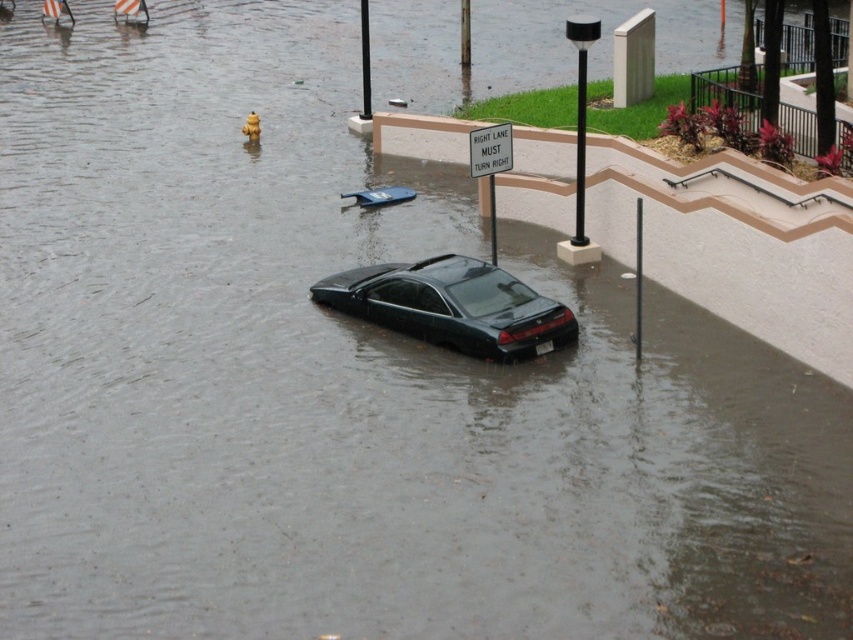
Question: Which point is farther to the camera?

Choices:
 (A) (489, 131)
 (B) (410, 324)

Answer: (A)

Question: Is dark gray matte car at center positioned behind white plastic sign at center?

Choices:
 (A) no
 (B) yes

Answer: (A)

Question: Among these points, which one is farthest from the camera?

Choices:
 (A) (363, 316)
 (B) (500, 147)

Answer: (B)

Question: Can you confirm if dark gray matte car at center is bigger than white plastic sign at center?

Choices:
 (A) no
 (B) yes

Answer: (B)

Question: Is dark gray matte car at center thinner than white plastic sign at center?

Choices:
 (A) yes
 (B) no

Answer: (B)

Question: Which of the following is the closest to the observer?

Choices:
 (A) dark gray matte car at center
 (B) white plastic sign at center

Answer: (A)